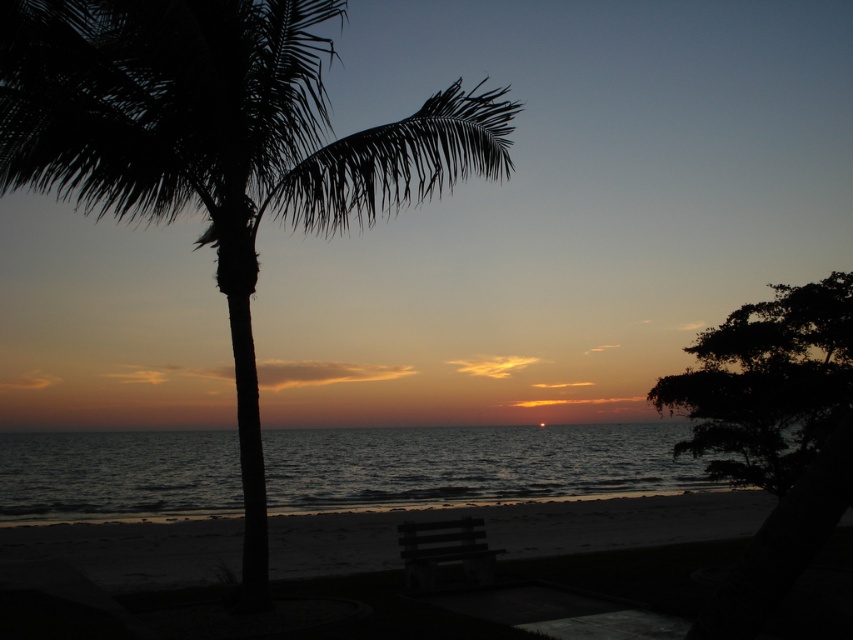
Question: Which object appears closest to the camera in this image?

Choices:
 (A) silhouette leafy palm at left
 (B) dark blue water at center
 (C) dark green leafy tree at right

Answer: (C)

Question: Which object is farther from the camera taking this photo?

Choices:
 (A) dark wood bench at lower center
 (B) dark green leafy tree at right
 (C) dark blue water at center
 (D) silhouette leafy palm at left

Answer: (C)

Question: Does silhouette leafy palm at left lie in front of dark blue water at center?

Choices:
 (A) no
 (B) yes

Answer: (B)

Question: Is dark blue water at center below dark wood bench at lower center?

Choices:
 (A) yes
 (B) no

Answer: (A)

Question: Among these objects, which one is nearest to the camera?

Choices:
 (A) silhouette leafy palm at left
 (B) smooth sand at lower center

Answer: (A)

Question: Can you confirm if dark blue water at center is positioned below dark wood bench at lower center?

Choices:
 (A) yes
 (B) no

Answer: (A)